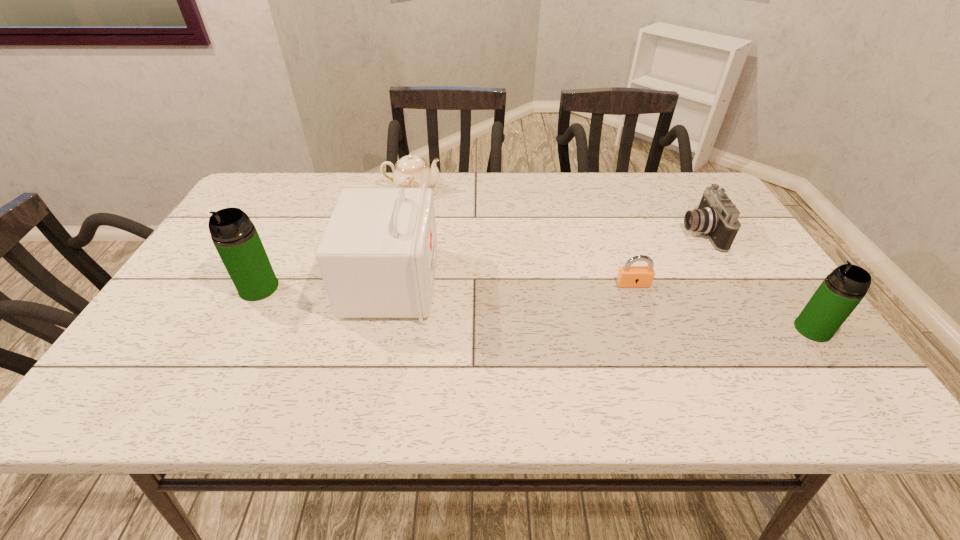
Identify the location of free space that satisfies the following two spatial constraints: 1. on the front-facing side of the first-aid kit; 2. from the spout of the leftmost object. (390, 288).

The height and width of the screenshot is (540, 960). What are the coordinates of `vacant point that satisfies the following two spatial constraints: 1. on the front-facing side of the fifth object from left to right; 2. to unlock the third object from right to left from the front` in the screenshot? It's located at (732, 284).